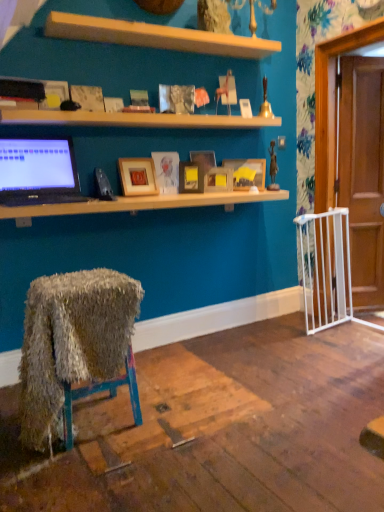
Question: Which direction should I rotate to look at matte wooden picture frame at center, which is the second picture frame from left to right?

Choices:
 (A) right
 (B) left

Answer: (B)

Question: Does matte wooden picture frame at center, which is the second picture frame from left to right, have a greater width compared to wooden at upper center, which is the 2th shelf from bottom to top?

Choices:
 (A) no
 (B) yes

Answer: (A)

Question: From the image's perspective, is matte wooden picture frame at center, which is the second picture frame from left to right, beneath wooden at upper center, which is the 2th shelf from bottom to top?

Choices:
 (A) yes
 (B) no

Answer: (A)

Question: Does matte wooden picture frame at center, which appears as the fifth picture frame when viewed from the right, have a lesser width compared to wooden at upper center, which is the 2th shelf from bottom to top?

Choices:
 (A) yes
 (B) no

Answer: (A)

Question: Is matte wooden picture frame at center, which is the second picture frame from left to right, facing away from wooden at upper center, which is the 2th shelf from bottom to top?

Choices:
 (A) no
 (B) yes

Answer: (A)

Question: Does matte wooden picture frame at center, which is the second picture frame from left to right, turn towards wooden at upper center, acting as the 1th shelf starting from the top?

Choices:
 (A) yes
 (B) no

Answer: (B)

Question: Considering the relative sizes of matte wooden picture frame at center, which is the second picture frame from left to right, and wooden at upper center, which is the 2th shelf from bottom to top, in the image provided, is matte wooden picture frame at center, which is the second picture frame from left to right, bigger than wooden at upper center, which is the 2th shelf from bottom to top,?

Choices:
 (A) yes
 (B) no

Answer: (B)

Question: Does wooden at upper center, acting as the 1th shelf starting from the top, have a greater height compared to matte black desk at upper center, positioned as the 1th desk in top-to-bottom order?

Choices:
 (A) no
 (B) yes

Answer: (B)

Question: From the image's perspective, would you say wooden at upper center, which is the 2th shelf from bottom to top, is shown under matte black desk at upper center, marked as the second desk in a bottom-to-top arrangement?

Choices:
 (A) no
 (B) yes

Answer: (A)

Question: Is wooden at upper center, which is the 2th shelf from bottom to top, far from matte black desk at upper center, marked as the second desk in a bottom-to-top arrangement?

Choices:
 (A) yes
 (B) no

Answer: (B)

Question: Is matte black desk at upper center, positioned as the 1th desk in top-to-bottom order, a part of wooden at upper center, which is the 2th shelf from bottom to top?

Choices:
 (A) yes
 (B) no

Answer: (B)

Question: Can you confirm if wooden at upper center, acting as the 1th shelf starting from the top, is wider than matte black desk at upper center, marked as the second desk in a bottom-to-top arrangement?

Choices:
 (A) no
 (B) yes

Answer: (A)

Question: Can you confirm if wooden at upper center, which is the 2th shelf from bottom to top, is bigger than matte black desk at upper center, marked as the second desk in a bottom-to-top arrangement?

Choices:
 (A) no
 (B) yes

Answer: (A)

Question: Can you confirm if matte wooden picture frame at center, the third picture frame in the right-to-left sequence, is taller than matte wooden picture frame at center, which appears as the fifth picture frame when viewed from the right?

Choices:
 (A) yes
 (B) no

Answer: (A)